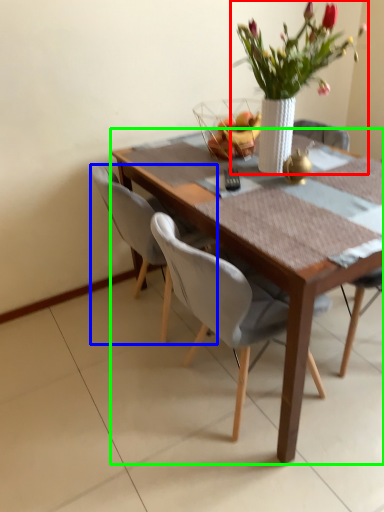
Question: Which object is the closest to the houseplant (highlighted by a red box)? Choose among these: chair (highlighted by a blue box) or kitchen & dining room table (highlighted by a green box).

Choices:
 (A) chair
 (B) kitchen & dining room table

Answer: (B)